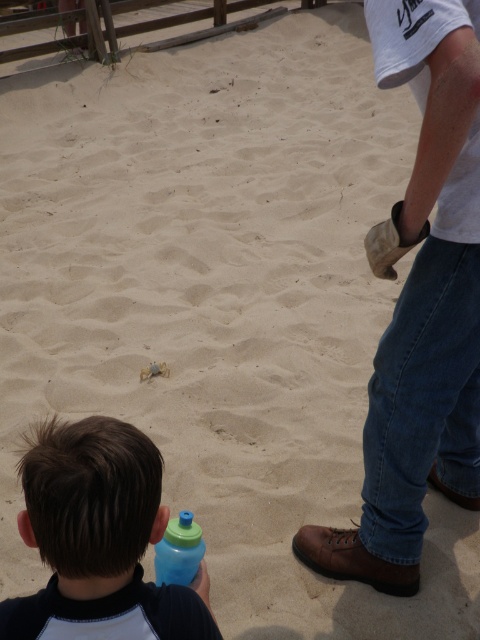
Is blue matte water bottle at lower left positioned before blue translucent bottle at lower center?

Yes, blue matte water bottle at lower left is closer to the viewer.

This screenshot has width=480, height=640. Find the location of `blue matte water bottle at lower left`. blue matte water bottle at lower left is located at coordinates (98, 540).

Identify the location of blue matte water bottle at lower left. (98, 540).

Is point (395, 577) closer to viewer compared to point (48, 561)?

No, it is not.

Is point (420, 310) closer to camera compared to point (92, 592)?

No, (420, 310) is further to viewer.

The width and height of the screenshot is (480, 640). In order to click on brown leather shoe at lower right in this screenshot , I will do `click(420, 305)`.

Looking at this image, does brown leather shoe at lower right lie behind blue translucent bottle at lower center?

No, brown leather shoe at lower right is in front of blue translucent bottle at lower center.

Based on the photo, is brown leather shoe at lower right closer to camera compared to blue translucent bottle at lower center?

Yes, brown leather shoe at lower right is closer to the viewer.

Is point (453, 260) positioned before point (160, 573)?

No.

I want to click on brown leather shoe at lower right, so click(420, 305).